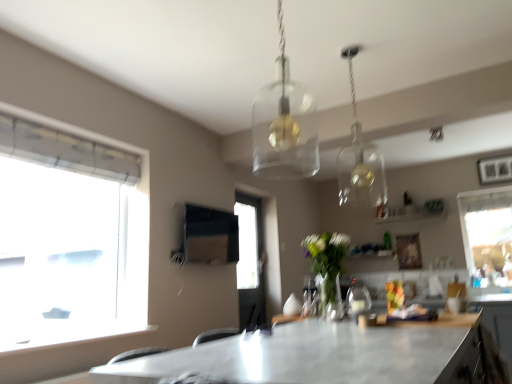
Locate an element on the screen. clear glass vase at center is located at coordinates (327, 262).

Locate an element on the screen. This screenshot has width=512, height=384. transparent glass window at right is located at coordinates (487, 234).

Describe the element at coordinates (284, 124) in the screenshot. I see `transparent glass pendant light at center, which ranks as the 2th lamp in back-to-front order` at that location.

How much space does transparent glass pendant light at center, which ranks as the 2th lamp in back-to-front order, occupy vertically?

The height of transparent glass pendant light at center, which ranks as the 2th lamp in back-to-front order, is 28.61 inches.

The width and height of the screenshot is (512, 384). What do you see at coordinates (316, 354) in the screenshot? I see `metallic gray table at center` at bounding box center [316, 354].

This screenshot has height=384, width=512. What do you see at coordinates (359, 159) in the screenshot?
I see `clear glass pendant light at upper center, the 2th lamp from the left` at bounding box center [359, 159].

At what (x,y) coordinates should I click in order to perform the action: click on clear glass vase at center. Please return your answer as a coordinate pair (x, y). Looking at the image, I should click on (327, 262).

From the image's perspective, relative to clear glass vase at center, is metallic gray table at center above or below?

metallic gray table at center is situated lower than clear glass vase at center in the image.

Is metallic gray table at center inside or outside of clear glass vase at center?

metallic gray table at center cannot be found inside clear glass vase at center.

Is metallic gray table at center oriented away from clear glass vase at center?

No, clear glass vase at center is not at the back of metallic gray table at center.

From a real-world perspective, is metallic gray table at center beneath clear glass vase at center?

Yes, from a real-world perspective, metallic gray table at center is under clear glass vase at center.

Is matte black cabinet at lower right shorter than transparent glass window at right?

Indeed, matte black cabinet at lower right has a lesser height compared to transparent glass window at right.

From a real-world perspective, is matte black cabinet at lower right positioned over transparent glass window at right based on gravity?

No, from a real-world perspective, matte black cabinet at lower right is not on top of transparent glass window at right.

What's the angular difference between matte black cabinet at lower right and transparent glass window at right's facing directions?

matte black cabinet at lower right and transparent glass window at right are facing 87.4 degrees away from each other.

Where is `window above the matte black cabinet at lower right (from a real-world perspective)`? The width and height of the screenshot is (512, 384). window above the matte black cabinet at lower right (from a real-world perspective) is located at coordinates (487, 234).

Is transparent glass window at right a part of clear glass pendant light at upper center, the 2th lamp from the left?

No, transparent glass window at right is not inside clear glass pendant light at upper center, the 2th lamp from the left.

Which object is closer to the camera taking this photo, clear glass pendant light at upper center, positioned as the 1th lamp in back-to-front order, or transparent glass window at right?

clear glass pendant light at upper center, positioned as the 1th lamp in back-to-front order, is more forward.

Which is more to the left, clear glass pendant light at upper center, the 2th lamp from the left, or transparent glass window at right?

clear glass pendant light at upper center, the 2th lamp from the left, is more to the left.

Which of these two, transparent glass pendant light at center, the second lamp in the right-to-left sequence, or clear glass vase at center, stands shorter?

Standing shorter between the two is clear glass vase at center.

What's the angular difference between transparent glass pendant light at center, the second lamp in the right-to-left sequence, and clear glass vase at center's facing directions?

The facing directions of transparent glass pendant light at center, the second lamp in the right-to-left sequence, and clear glass vase at center are 91 degrees apart.

You are a GUI agent. You are given a task and a screenshot of the screen. Output one action in this format:
    pyautogui.click(x=<x>, y=<y>)
    Task: Click on the plant below the transparent glass pendant light at center, the first lamp viewed from the front (from a real-world perspective)
    The image size is (512, 384).
    Given the screenshot: What is the action you would take?
    (x=327, y=262)

In terms of size, does transparent glass pendant light at center, the second lamp in the right-to-left sequence, appear bigger or smaller than clear glass vase at center?

In the image, transparent glass pendant light at center, the second lamp in the right-to-left sequence, appears to be smaller than clear glass vase at center.

Is metallic gray table at center directly adjacent to clear glass pendant light at upper center, which appears as the 1th lamp when viewed from the right?

metallic gray table at center and clear glass pendant light at upper center, which appears as the 1th lamp when viewed from the right, are not in contact.

Could you tell me if metallic gray table at center is turned towards clear glass pendant light at upper center, the 2th lamp from the left?

No, metallic gray table at center is not turned towards clear glass pendant light at upper center, the 2th lamp from the left.

In order to click on table in front of the clear glass pendant light at upper center, which is counted as the second lamp, starting from the front in this screenshot , I will do `click(316, 354)`.

Is point (177, 358) farther from viewer compared to point (365, 147)?

No, (177, 358) is closer to viewer.

Does matte black cabinet at lower right have a smaller size compared to clear glass pendant light at upper center, positioned as the 1th lamp in back-to-front order?

Yes.

Considering the relative sizes of matte black cabinet at lower right and clear glass pendant light at upper center, which is counted as the second lamp, starting from the front, in the image provided, is matte black cabinet at lower right wider than clear glass pendant light at upper center, which is counted as the second lamp, starting from the front,?

No.

Would you say matte black cabinet at lower right contains clear glass pendant light at upper center, which appears as the 1th lamp when viewed from the right?

Definitely not — clear glass pendant light at upper center, which appears as the 1th lamp when viewed from the right, is not inside matte black cabinet at lower right.

Consider the image. From the image's perspective, is matte black cabinet at lower right on top of clear glass pendant light at upper center, which is counted as the second lamp, starting from the front?

No, from the image's perspective, matte black cabinet at lower right is not above clear glass pendant light at upper center, which is counted as the second lamp, starting from the front.

Between point (176, 372) and point (269, 123), which one is positioned behind?

The point (269, 123) is behind.

Is metallic gray table at center next to transparent glass pendant light at center, the second lamp in the right-to-left sequence, and touching it?

No, metallic gray table at center is not making contact with transparent glass pendant light at center, the second lamp in the right-to-left sequence.

From a real-world perspective, is metallic gray table at center positioned over transparent glass pendant light at center, which ranks as the 2th lamp in back-to-front order, based on gravity?

No.

Is metallic gray table at center aimed at transparent glass pendant light at center, the second lamp in the right-to-left sequence?

No, metallic gray table at center is not aimed at transparent glass pendant light at center, the second lamp in the right-to-left sequence.

At what (x,y) coordinates should I click in order to perform the action: click on plant behind the metallic gray table at center. Please return your answer as a coordinate pair (x, y). Looking at the image, I should click on (327, 262).

Locate an element on the screen. window that appears above the matte black cabinet at lower right (from the image's perspective) is located at coordinates (487, 234).

Estimate the real-world distances between objects in this image. Which object is further from metallic gray table at center, clear glass vase at center or transparent glass pendant light at center, the second lamp in the right-to-left sequence?

transparent glass pendant light at center, the second lamp in the right-to-left sequence.

Estimate the real-world distances between objects in this image. Which object is closer to transparent glass pendant light at center, which is counted as the first lamp, starting from the left, transparent glass window at right or matte black cabinet at lower right?

matte black cabinet at lower right is closer to transparent glass pendant light at center, which is counted as the first lamp, starting from the left.

Estimate the real-world distances between objects in this image. Which object is closer to matte black cabinet at lower right, clear glass vase at center or transparent glass pendant light at center, which ranks as the 2th lamp in back-to-front order?

Among the two, clear glass vase at center is located nearer to matte black cabinet at lower right.

When comparing their distances from clear glass pendant light at upper center, which appears as the 1th lamp when viewed from the right, does transparent glass pendant light at center, the second lamp in the right-to-left sequence, or matte black cabinet at lower right seem further?

The object further to clear glass pendant light at upper center, which appears as the 1th lamp when viewed from the right, is transparent glass pendant light at center, the second lamp in the right-to-left sequence.

Looking at this image, estimate the real-world distances between objects in this image. Which object is further from transparent glass pendant light at center, the first lamp viewed from the front, transparent glass window at right or clear glass vase at center?

The object further to transparent glass pendant light at center, the first lamp viewed from the front, is transparent glass window at right.

Which object lies nearer to the anchor point transparent glass pendant light at center, the first lamp viewed from the front, clear glass pendant light at upper center, the 2th lamp from the left, or clear glass vase at center?

clear glass vase at center lies closer to transparent glass pendant light at center, the first lamp viewed from the front, than the other object.

Considering their positions, is transparent glass window at right positioned closer to transparent glass pendant light at center, which ranks as the 2th lamp in back-to-front order, than clear glass pendant light at upper center, positioned as the 1th lamp in back-to-front order?

clear glass pendant light at upper center, positioned as the 1th lamp in back-to-front order, is closer to transparent glass pendant light at center, which ranks as the 2th lamp in back-to-front order.

Based on their spatial positions, is transparent glass window at right or matte black cabinet at lower right further from metallic gray table at center?

transparent glass window at right lies further to metallic gray table at center than the other object.

I want to click on cabinetry between metallic gray table at center and transparent glass window at right in the front-back direction, so click(496, 315).

I want to click on lamp located between transparent glass pendant light at center, which ranks as the 2th lamp in back-to-front order, and transparent glass window at right in the depth direction, so click(359, 159).

At what (x,y) coordinates should I click in order to perform the action: click on plant between clear glass pendant light at upper center, the 2th lamp from the left, and transparent glass window at right, along the z-axis. Please return your answer as a coordinate pair (x, y). The height and width of the screenshot is (384, 512). Looking at the image, I should click on (327, 262).

Identify the location of lamp between transparent glass pendant light at center, which ranks as the 2th lamp in back-to-front order, and matte black cabinet at lower right in the up-down direction. Image resolution: width=512 pixels, height=384 pixels. (359, 159).